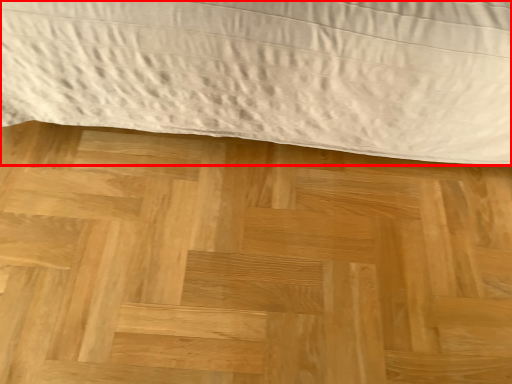
Question: From the image's perspective, what is the correct spatial positioning of bed (annotated by the red box) in reference to plywood?

Choices:
 (A) below
 (B) above

Answer: (B)